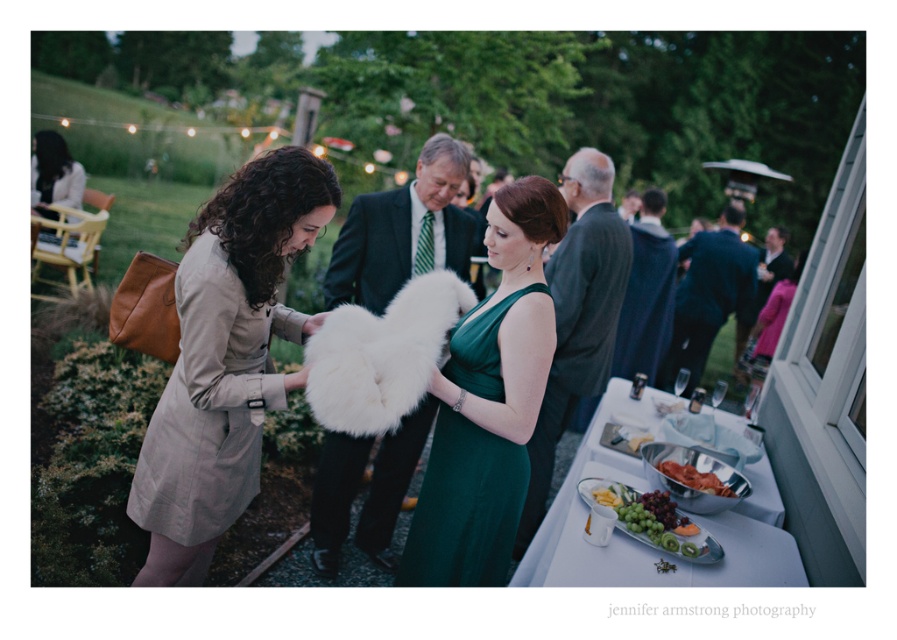
Question: Which point is farther to the camera?

Choices:
 (A) (544, 577)
 (B) (603, 499)

Answer: (B)

Question: Does dark suit at center appear over white fluffy fur at center?

Choices:
 (A) yes
 (B) no

Answer: (B)

Question: Which object is the farthest from the dark gray suit at center?

Choices:
 (A) dark suit at center
 (B) green matte platter at lower center
 (C) emerald satin dress at center

Answer: (C)

Question: Does dark blue suit at center appear on the left side of green matte platter at lower center?

Choices:
 (A) yes
 (B) no

Answer: (B)

Question: Among these points, which one is farthest from the camera?

Choices:
 (A) (710, 486)
 (B) (490, 225)
 (C) (655, 253)

Answer: (C)

Question: Is silver metallic tray at lower right smaller than dark blue suit at center?

Choices:
 (A) yes
 (B) no

Answer: (A)